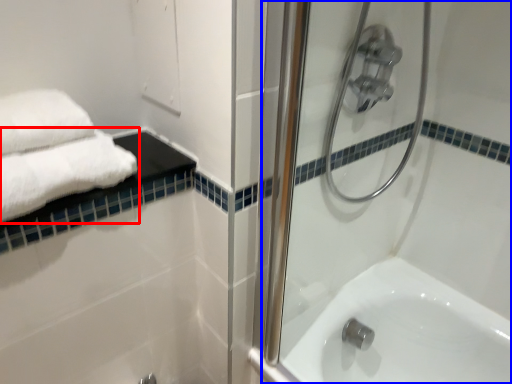
Question: Among these objects, which one is farthest to the camera, towel (highlighted by a red box) or shower door (highlighted by a blue box)?

Choices:
 (A) towel
 (B) shower door

Answer: (A)